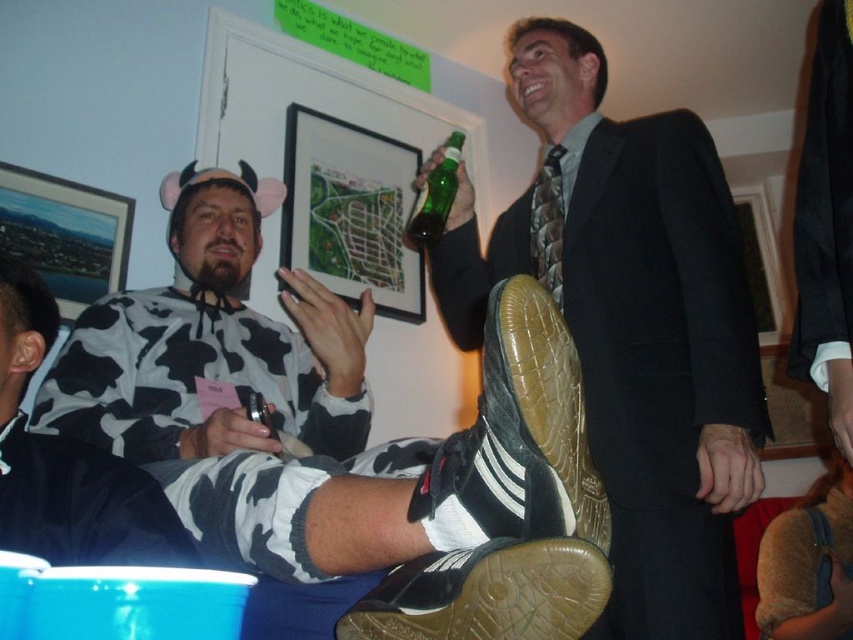
Question: Can you confirm if shiny black suit at upper right is positioned to the left of leather braided tie at upper center?

Choices:
 (A) yes
 (B) no

Answer: (B)

Question: Among these points, which one is nearest to the camera?

Choices:
 (A) (451, 612)
 (B) (531, 273)
 (C) (448, 161)
 (D) (669, 300)

Answer: (A)

Question: Considering the real-world distances, which object is farthest from the shiny black suit at upper right?

Choices:
 (A) black and white spotted shirt at lower left
 (B) leather braided tie at upper center

Answer: (A)

Question: Which of the following is the farthest from the observer?

Choices:
 (A) cow print sweater at center
 (B) leather braided tie at upper center

Answer: (B)

Question: Does shiny black suit at upper right have a lesser width compared to green glass bottle at upper center?

Choices:
 (A) no
 (B) yes

Answer: (A)

Question: Is shiny black suit at upper right positioned before black and white spotted shirt at lower left?

Choices:
 (A) yes
 (B) no

Answer: (B)